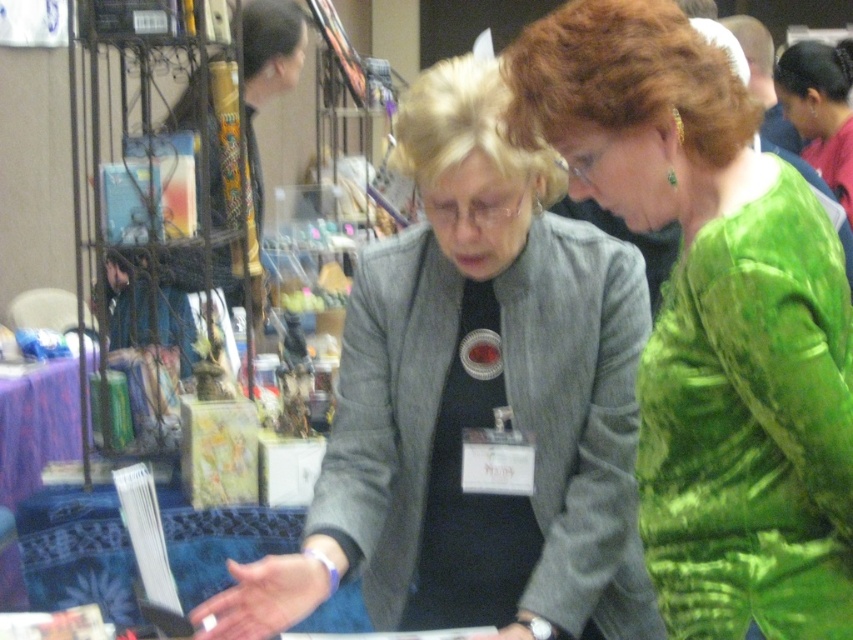
Question: In this image, where is matte gray blazer at center located relative to green textured dress at center?

Choices:
 (A) below
 (B) above

Answer: (B)

Question: Among these objects, which one is nearest to the camera?

Choices:
 (A) matte gray blazer at center
 (B) green shiny dress at upper right

Answer: (A)

Question: In this image, where is green shiny dress at center located relative to green textured dress at center?

Choices:
 (A) above
 (B) below

Answer: (A)

Question: Which object is the farthest from the green shiny dress at upper right?

Choices:
 (A) matte gray blazer at center
 (B) green shiny dress at center

Answer: (B)

Question: Is green shiny dress at center closer to the viewer compared to green shiny dress at upper right?

Choices:
 (A) yes
 (B) no

Answer: (A)

Question: Among these points, which one is farthest from the camera?

Choices:
 (A) (691, 605)
 (B) (828, 77)
 (C) (689, 372)

Answer: (B)